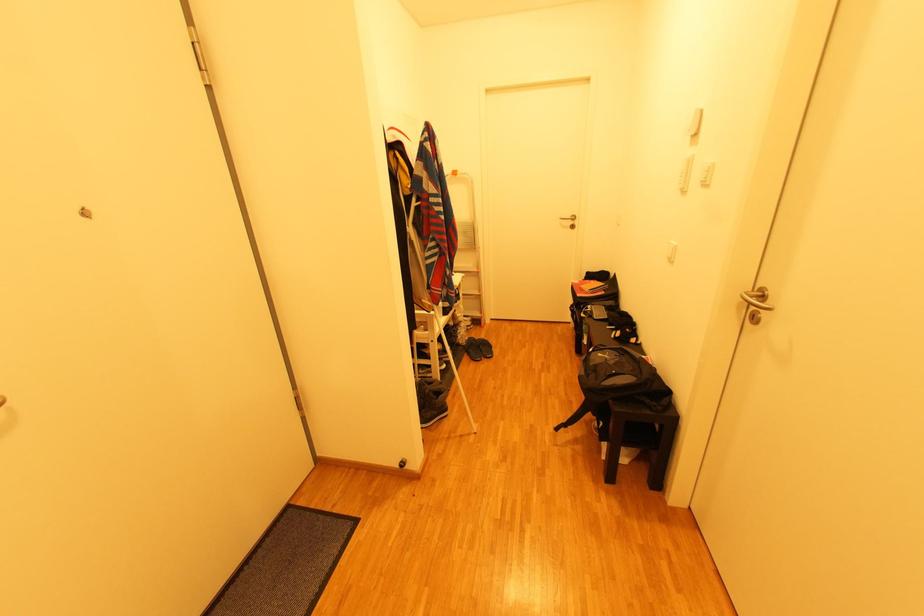
Locate an element on the screen. The width and height of the screenshot is (924, 616). black backpack is located at coordinates (616, 382).